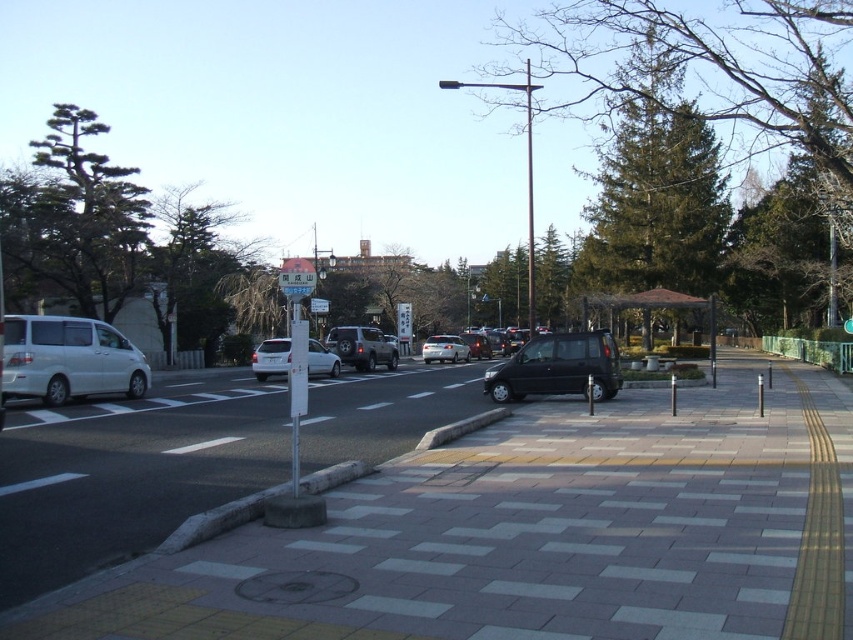
You are a pedestrian standing on the sidewalk and want to cross the street. There is a green textured tree at center and a silver metallic sedan at center. Which object is closer to the street side?

The green textured tree at center is to the right of the silver metallic sedan at center, so the silver metallic sedan at center is closer to the street side.

You are a visually impaired pedestrian using a cane. You are currently standing on the gray concrete sidewalk at center and want to reach the blue plastic street sign at center. Which direction should you move to reach it?

The gray concrete sidewalk at center is to the right of the blue plastic street sign at center. Therefore, to reach the blue plastic street sign at center, you should move to your left.

Based on the photo, A delivery person needs to cross the street from the shiny black van at center to the signpost. The delivery person can carry a heavy package and walk 15 meters. Will they be able to reach the signpost without dropping the package?

The distance between the shiny black van at center and the signpost is 17.72 meters. Since the delivery person can only walk 15 meters while carrying the package, they will not be able to reach the signpost without dropping it.